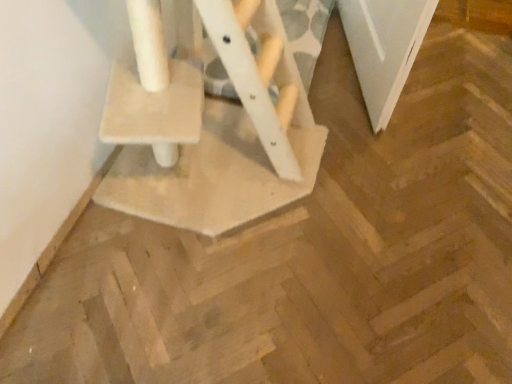
The width and height of the screenshot is (512, 384). What do you see at coordinates (217, 170) in the screenshot? I see `beige textured cat tree at center` at bounding box center [217, 170].

Identify the location of beige textured cat tree at center. The image size is (512, 384). tap(217, 170).

Locate an element on the screen. The image size is (512, 384). beige textured cat tree at center is located at coordinates (217, 170).